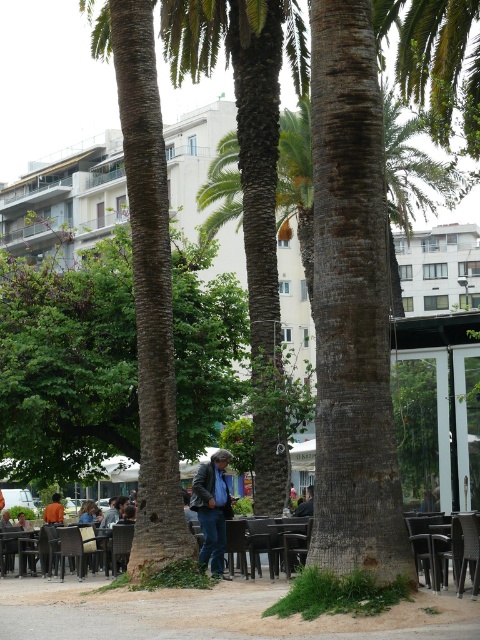
Question: Is black plastic chair at lower center wider than denim jacket at lower center?

Choices:
 (A) no
 (B) yes

Answer: (A)

Question: Which point is closer to the camera?

Choices:
 (A) (181, 372)
 (B) (305, 490)
 (C) (475, 586)
 (D) (124, 536)

Answer: (C)

Question: Which point is farther to the camera?

Choices:
 (A) (194, 435)
 (B) (478, 561)
 (C) (222, 508)
 (D) (118, 532)

Answer: (A)

Question: Which object appears farthest from the camera in this image?

Choices:
 (A) metallic silver chair at lower left
 (B) black plastic chair at lower center

Answer: (A)

Question: Is green rough bark tree at center closer to camera compared to black plastic chair at lower right?

Choices:
 (A) yes
 (B) no

Answer: (B)

Question: Can you confirm if green rough bark tree at center is smaller than rattan wicker chair at center?

Choices:
 (A) yes
 (B) no

Answer: (B)